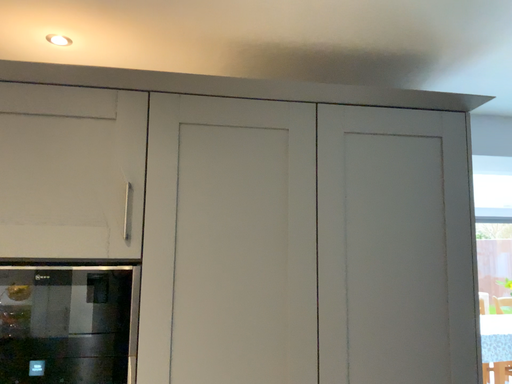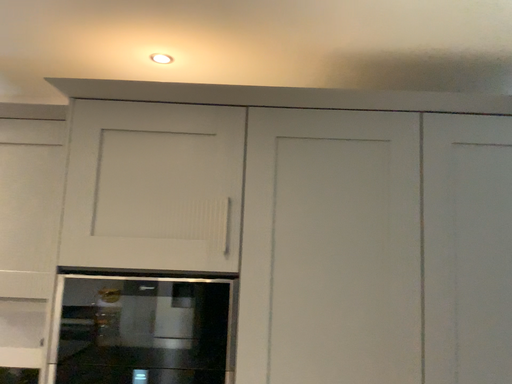
Question: How did the camera likely rotate when shooting the video?

Choices:
 (A) rotated left
 (B) rotated right

Answer: (A)